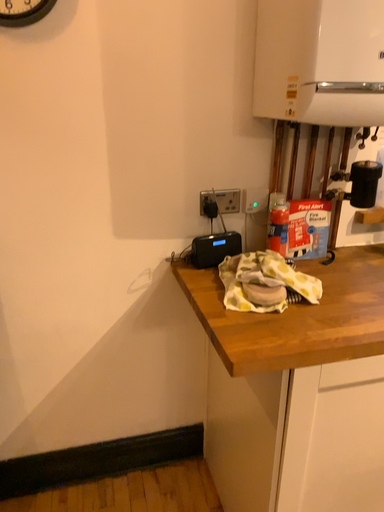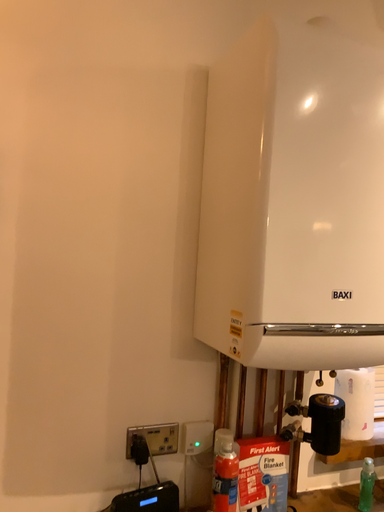
Question: How did the camera likely rotate when shooting the video?

Choices:
 (A) rotated upward
 (B) rotated downward

Answer: (A)